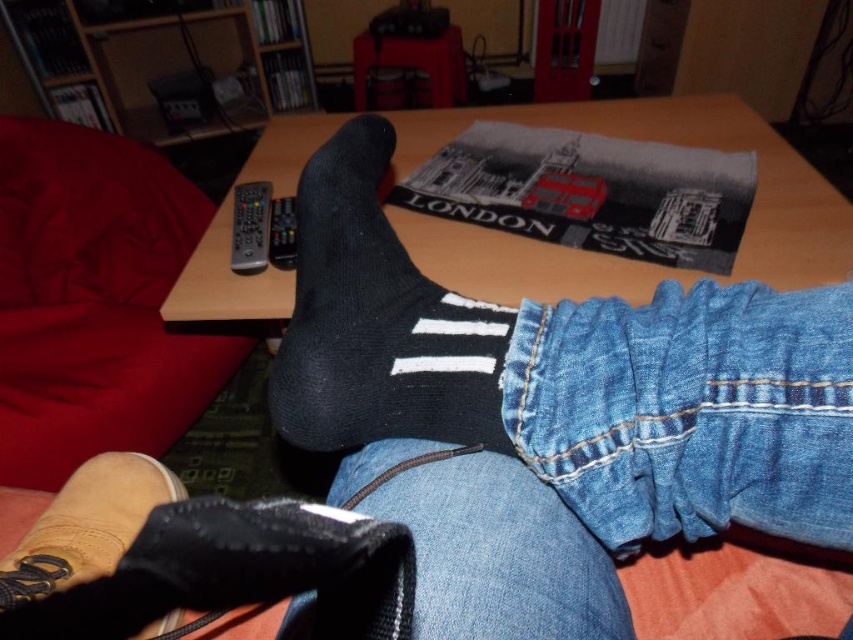
You are a delivery robot that needs to place a small package between the black knitted sock at center and the black suede sock at lower left. The package is 8 inches long. Can you fit it between them?

The distance between the black knitted sock at center and the black suede sock at lower left is 7.67 inches, which is shorter than the package length of 8 inches. Therefore, the package cannot fit between them.

You are a robot trying to place a small object on the table. The table is at the center of the image. Where should you avoid placing the object to ensure it doesnno overlap with the denim at lower right?

You should avoid placing the object near the point at coordinates [689,410] to prevent overlapping with the denim at lower right.

You are a robot trying to pick up the black plastic remote at upper left. To avoid touching the denim at lower right, which is in your way, should you move the remote to the left or right?

The denim at lower right is on the right side of the black plastic remote at upper left, so moving the remote to the left would avoid the denim at lower right.